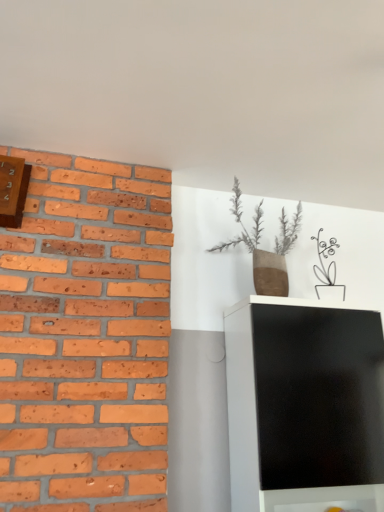
Question: Considering the relative sizes of brown textured vase at upper center and wooden clock at upper left in the image provided, is brown textured vase at upper center shorter than wooden clock at upper left?

Choices:
 (A) yes
 (B) no

Answer: (B)

Question: Is brown textured vase at upper center with wooden clock at upper left?

Choices:
 (A) no
 (B) yes

Answer: (A)

Question: Is brown textured vase at upper center positioned with its back to wooden clock at upper left?

Choices:
 (A) yes
 (B) no

Answer: (B)

Question: Could you tell me if brown textured vase at upper center is facing wooden clock at upper left?

Choices:
 (A) yes
 (B) no

Answer: (B)

Question: Considering the relative sizes of brown textured vase at upper center and wooden clock at upper left in the image provided, is brown textured vase at upper center bigger than wooden clock at upper left?

Choices:
 (A) yes
 (B) no

Answer: (A)

Question: Does brown textured vase at upper center have a lesser width compared to wooden clock at upper left?

Choices:
 (A) no
 (B) yes

Answer: (A)

Question: From the image's perspective, is wooden clock at upper left located above brown textured vase at upper center?

Choices:
 (A) yes
 (B) no

Answer: (A)

Question: Can you confirm if wooden clock at upper left is bigger than brown textured vase at upper center?

Choices:
 (A) yes
 (B) no

Answer: (B)

Question: Are wooden clock at upper left and brown textured vase at upper center making contact?

Choices:
 (A) no
 (B) yes

Answer: (A)

Question: Considering the relative sizes of wooden clock at upper left and brown textured vase at upper center in the image provided, is wooden clock at upper left shorter than brown textured vase at upper center?

Choices:
 (A) no
 (B) yes

Answer: (B)

Question: Is wooden clock at upper left to the right of brown textured vase at upper center from the viewer's perspective?

Choices:
 (A) yes
 (B) no

Answer: (B)

Question: Does wooden clock at upper left have a greater width compared to brown textured vase at upper center?

Choices:
 (A) no
 (B) yes

Answer: (A)

Question: Based on their sizes in the image, would you say brown textured vase at upper center is bigger or smaller than wooden clock at upper left?

Choices:
 (A) small
 (B) big

Answer: (B)